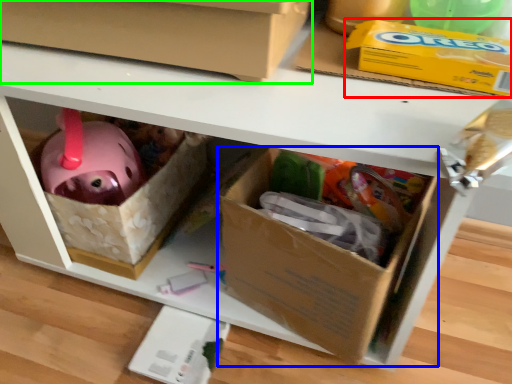
Question: Which object is the closest to the storage box (highlighted by a red box)? Choose among these: box (highlighted by a blue box) or box (highlighted by a green box).

Choices:
 (A) box
 (B) box

Answer: (B)